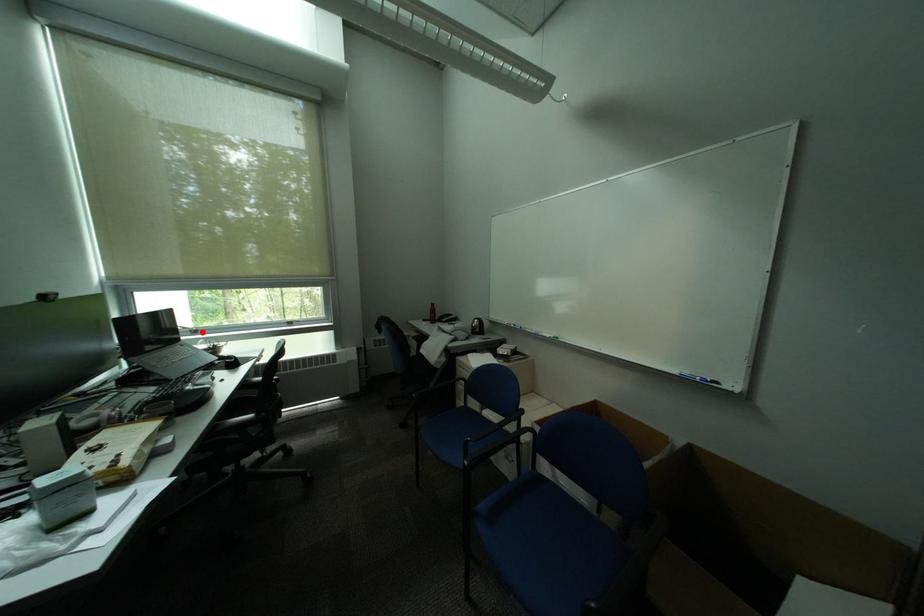
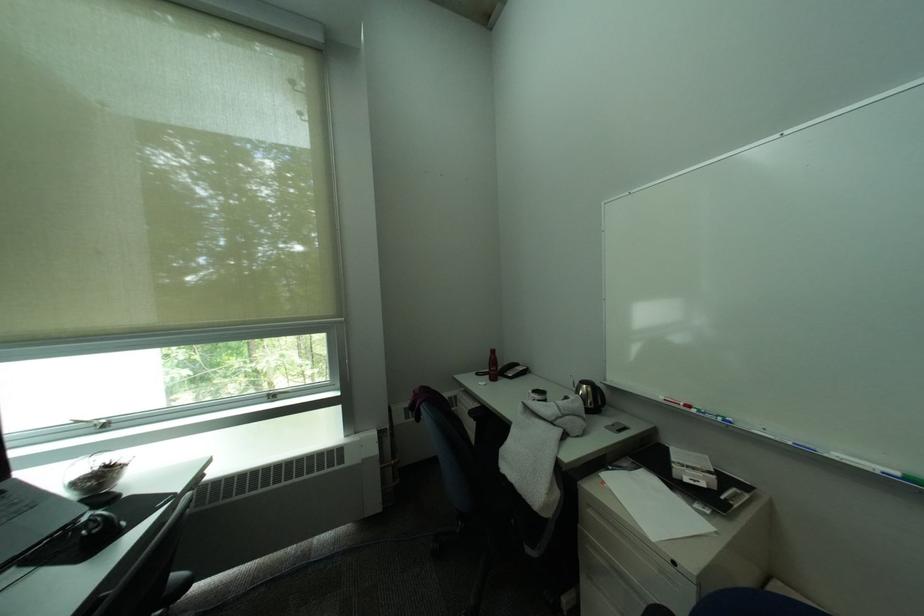
Question: I am providing you with two images of the same scene from different viewpoints. A red point is shown in image1. For the corresponding object point in image2, is it positioned nearer or farther from the camera?

Choices:
 (A) Nearer
 (B) Farther

Answer: (A)